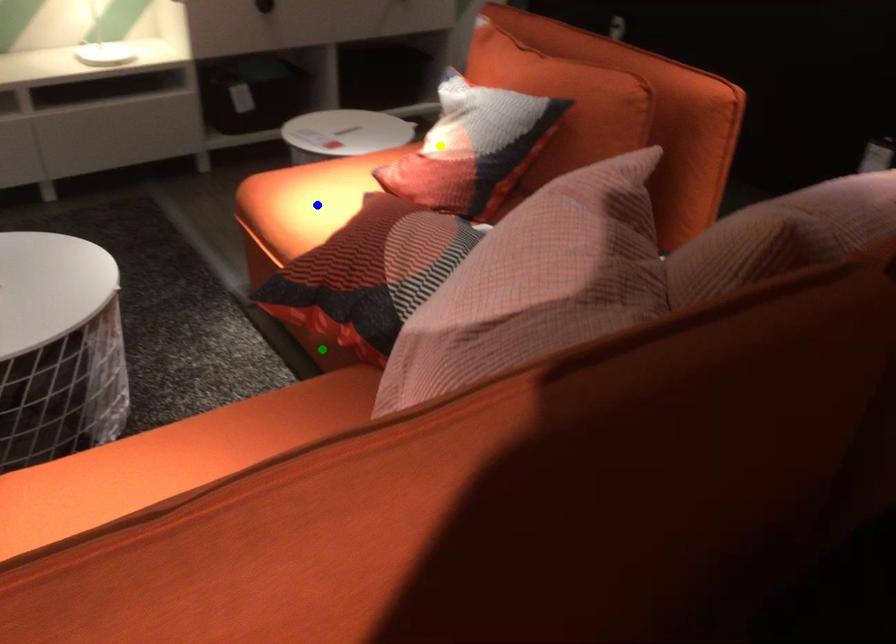
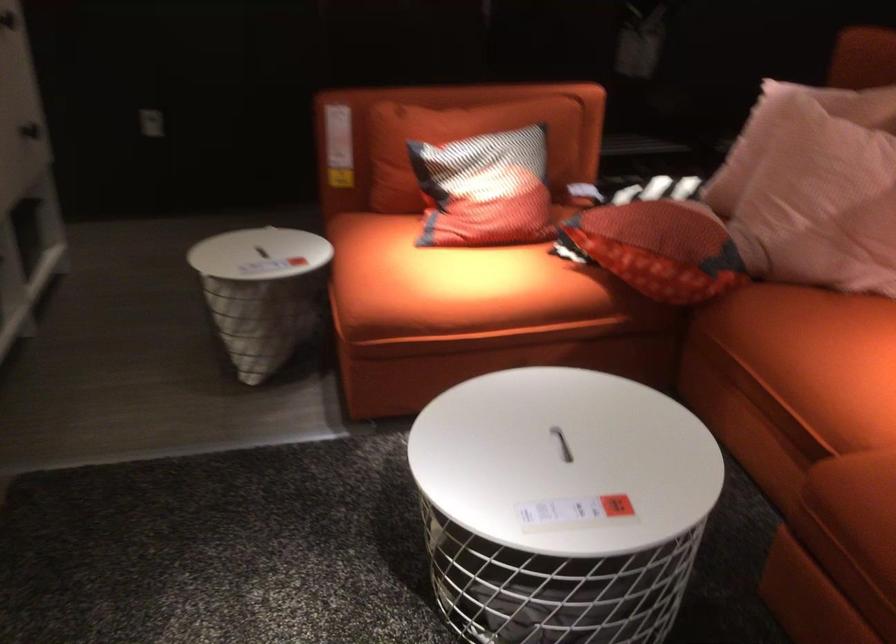
I am providing you with two images of the same scene from different viewpoints. Three points are marked in image1. Which point corresponds to a part or object that is occluded in image2?In image1, three points are marked. Which of them correspond to a part or object that is occluded in image2?Among the three points shown in image1, which one corresponds to a part or object that is no longer visible due to occlusion in image2?

green point cannot be seen in image2.